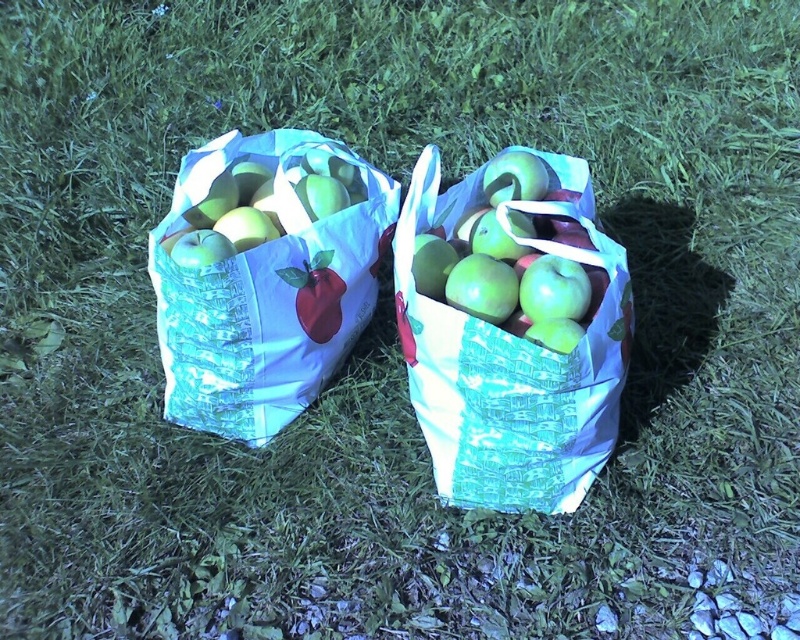
Question: Does white paper bag with apples at left appear on the left side of green matte apple at center?

Choices:
 (A) no
 (B) yes

Answer: (B)

Question: Does white paper bag with apples at left have a larger size compared to matte white bag at center?

Choices:
 (A) yes
 (B) no

Answer: (A)

Question: Which of the following is the closest to the observer?

Choices:
 (A) (570, 468)
 (B) (462, 269)
 (C) (300, 250)

Answer: (B)

Question: Which point is farther to the camera?

Choices:
 (A) (417, 228)
 (B) (236, 410)
 (C) (584, 269)

Answer: (B)

Question: Considering the relative positions of matte white bag at center and green matte apple at center in the image provided, where is matte white bag at center located with respect to green matte apple at center?

Choices:
 (A) right
 (B) left

Answer: (A)

Question: Estimate the real-world distances between objects in this image. Which object is closer to the green matte apple at center?

Choices:
 (A) matte white bag at center
 (B) white paper bag with apples at left

Answer: (A)